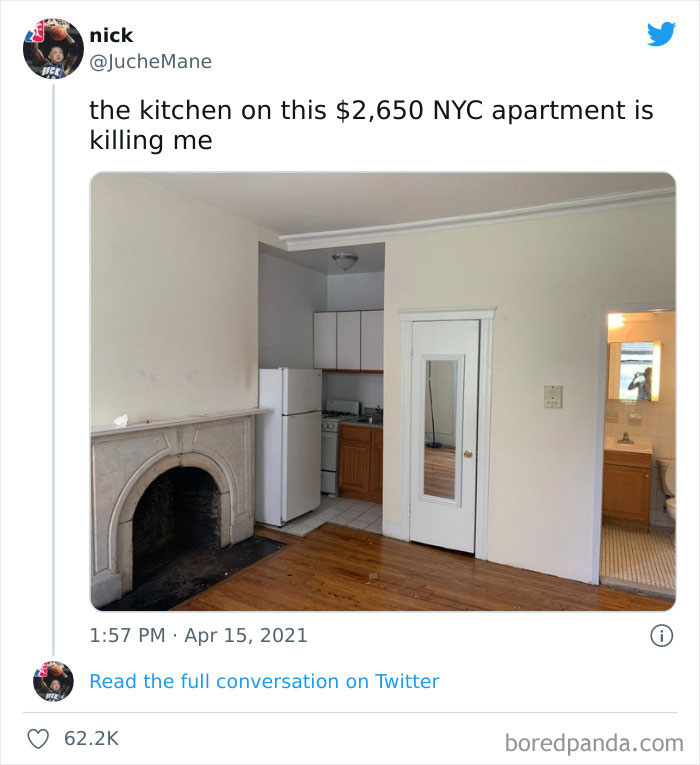
The image size is (700, 765). Identify the location of fridge. (312, 389).